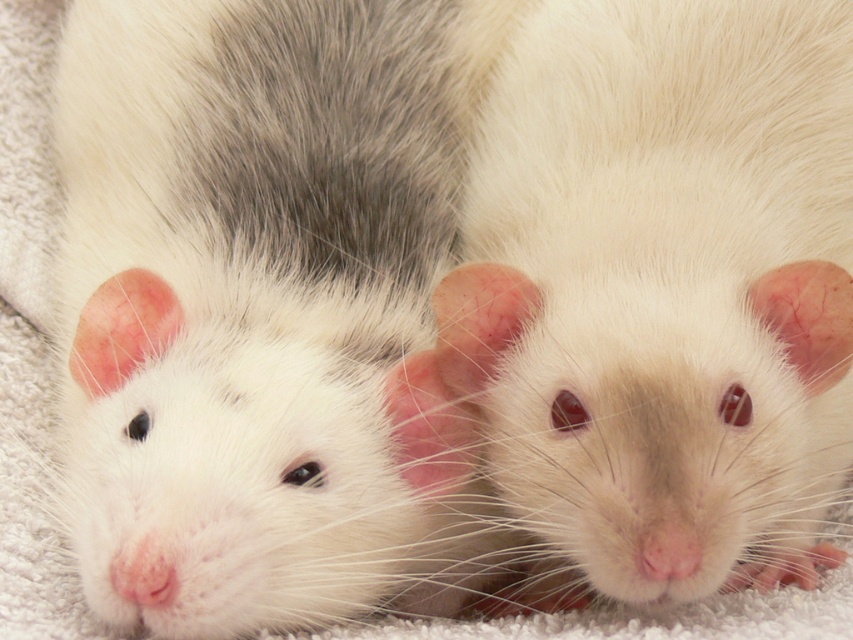
Can you confirm if white soft fur hamster at center is positioned to the left of white fur hamster at center?

Indeed, white soft fur hamster at center is positioned on the left side of white fur hamster at center.

Where is `white soft fur hamster at center`? white soft fur hamster at center is located at coordinates (253, 310).

Consider the image. Who is more forward, (380, 51) or (695, 292)?

Point (695, 292) is more forward.

Find the location of `white soft fur hamster at center`. white soft fur hamster at center is located at coordinates click(253, 310).